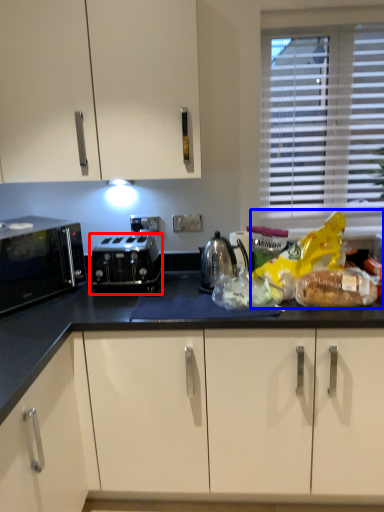
Question: Which of the following is the closest to the observer, toaster (highlighted by a red box) or food (highlighted by a blue box)?

Choices:
 (A) toaster
 (B) food

Answer: (B)